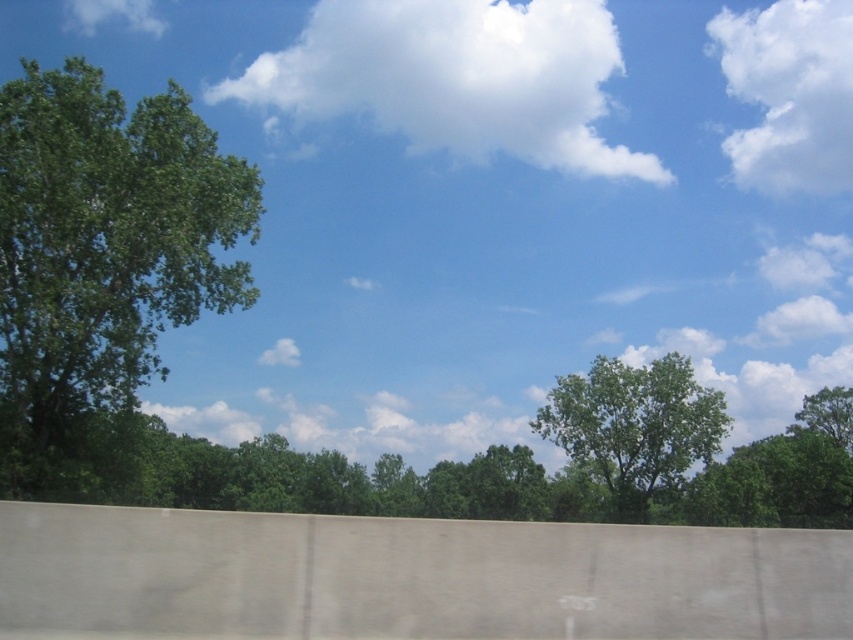
Question: Considering the real-world distances, which object is farthest from the white fluffy cloud at upper left?

Choices:
 (A) white fluffy cloud at upper center
 (B) green leafy tree at right

Answer: (B)

Question: Which point appears farthest from the camera in this image?

Choices:
 (A) (821, 112)
 (B) (44, 404)
 (C) (840, 417)
 (D) (119, 1)

Answer: (A)

Question: Can you confirm if green leafy tree at left is wider than white fluffy cloud at upper center?

Choices:
 (A) no
 (B) yes

Answer: (A)

Question: Is green leafy tree at left to the right of green leafy tree at right from the viewer's perspective?

Choices:
 (A) yes
 (B) no

Answer: (B)

Question: Which point is closer to the camera taking this photo?

Choices:
 (A) (840, 388)
 (B) (793, 36)

Answer: (A)

Question: From the image, what is the correct spatial relationship of white fluffy cloud at upper right in relation to green leafy tree at center?

Choices:
 (A) above
 (B) below

Answer: (A)